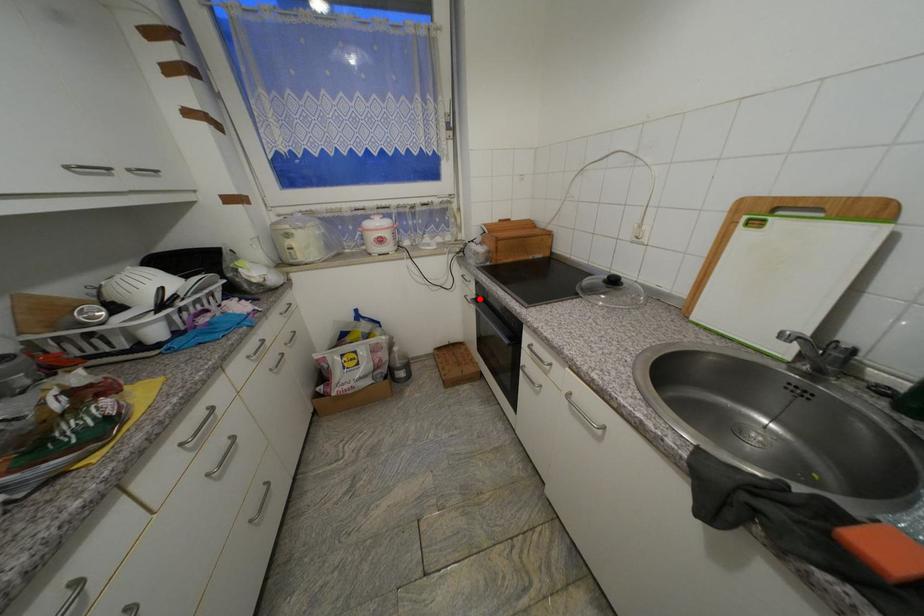
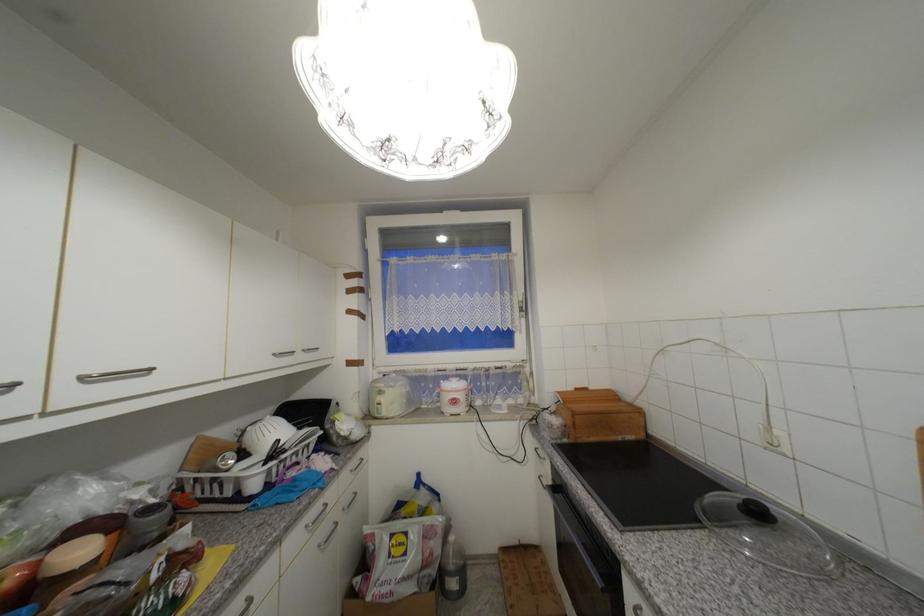
Question: A red point is marked in image1. In image2, is the corresponding 3D point closer to the camera or farther? Reply with the corresponding letter.

Choices:
 (A) The corresponding 3D point is closer.
 (B) The corresponding 3D point is farther.

Answer: (B)